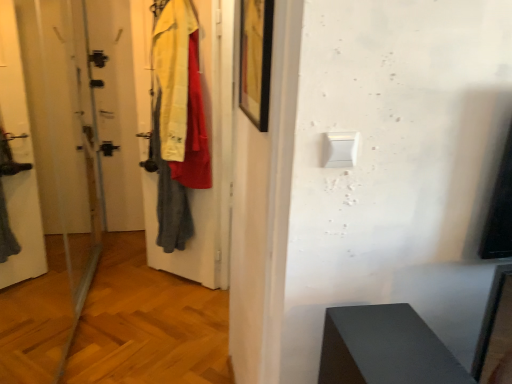
Question: Would you say white plastic light switch at upper center is outside black matte picture frame at upper center?

Choices:
 (A) no
 (B) yes

Answer: (B)

Question: From the image's perspective, is white plastic light switch at upper center above black matte picture frame at upper center?

Choices:
 (A) yes
 (B) no

Answer: (B)

Question: Is the position of white plastic light switch at upper center more distant than that of black matte picture frame at upper center?

Choices:
 (A) yes
 (B) no

Answer: (B)

Question: Does white plastic light switch at upper center appear on the right side of black matte picture frame at upper center?

Choices:
 (A) no
 (B) yes

Answer: (B)

Question: Does white plastic light switch at upper center turn towards black matte picture frame at upper center?

Choices:
 (A) yes
 (B) no

Answer: (B)

Question: Is white plastic light switch at upper center facing away from black matte picture frame at upper center?

Choices:
 (A) no
 (B) yes

Answer: (B)

Question: Does black matte picture frame at upper center have a larger size compared to transparent glass screen door at left?

Choices:
 (A) yes
 (B) no

Answer: (B)

Question: Is black matte picture frame at upper center positioned far away from transparent glass screen door at left?

Choices:
 (A) yes
 (B) no

Answer: (A)

Question: From a real-world perspective, is black matte picture frame at upper center located beneath transparent glass screen door at left?

Choices:
 (A) yes
 (B) no

Answer: (B)

Question: Is black matte picture frame at upper center wider than transparent glass screen door at left?

Choices:
 (A) yes
 (B) no

Answer: (B)

Question: Is black matte picture frame at upper center shorter than transparent glass screen door at left?

Choices:
 (A) yes
 (B) no

Answer: (A)

Question: Is the depth of black matte picture frame at upper center greater than that of transparent glass screen door at left?

Choices:
 (A) no
 (B) yes

Answer: (B)

Question: Is transparent glass screen door at left positioned far away from black matte picture frame at upper center?

Choices:
 (A) no
 (B) yes

Answer: (B)